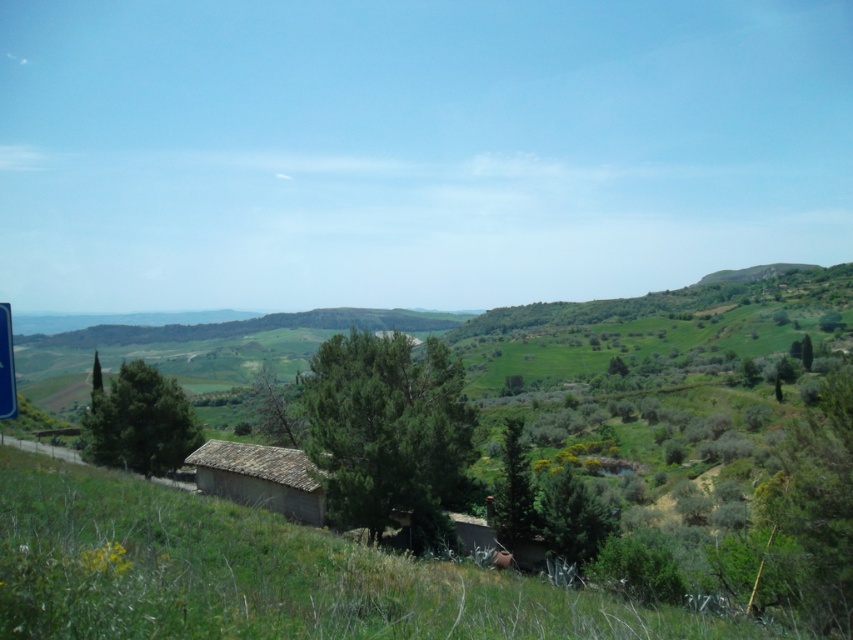
You are a gardener who wants to plant a new tree in the area. Considering the green grassy at center and the brown stone hut at center, which location would provide more space for the tree to grow taller?

The green grassy at center has a greater height compared to the brown stone hut at center, so planting the tree there would provide more vertical space for growth.

You are standing at point (260, 477) in the rural landscape. What structure can you see at your current location?

At point (260, 477) lies a brown stone hut at center.